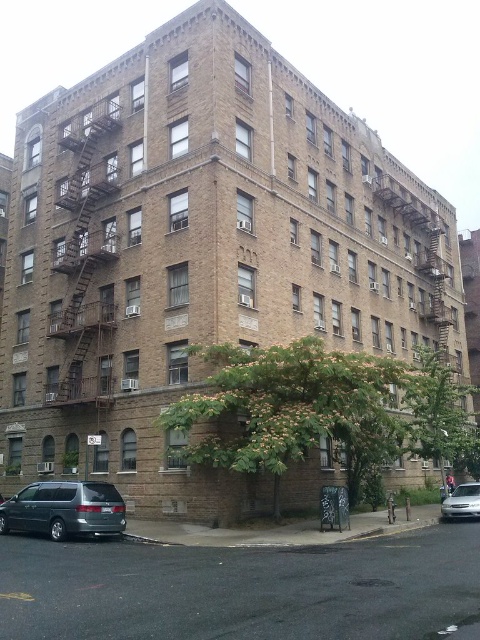
Does brown metal fire escape at left have a larger size compared to metallic gray minivan at lower left?

Yes, brown metal fire escape at left is bigger than metallic gray minivan at lower left.

Locate an element on the screen. This screenshot has height=640, width=480. brown metal fire escape at left is located at coordinates (84, 244).

Can you confirm if brown metal fire escape at left is positioned to the right of silver metallic sedan at lower right?

In fact, brown metal fire escape at left is to the left of silver metallic sedan at lower right.

Does brown metal fire escape at left have a greater width compared to silver metallic sedan at lower right?

Indeed, brown metal fire escape at left has a greater width compared to silver metallic sedan at lower right.

Find the location of `brown metal fire escape at left`. brown metal fire escape at left is located at coordinates (84, 244).

Where is `brown metal fire escape at left`? The height and width of the screenshot is (640, 480). brown metal fire escape at left is located at coordinates (84, 244).

Does metallic gray minivan at lower left appear over silver metallic sedan at lower right?

Yes.

Does metallic gray minivan at lower left have a lesser height compared to silver metallic sedan at lower right?

Yes.

Which is in front, point (9, 506) or point (464, 486)?

Point (9, 506)

Image resolution: width=480 pixels, height=640 pixels. Identify the location of metallic gray minivan at lower left. (64, 509).